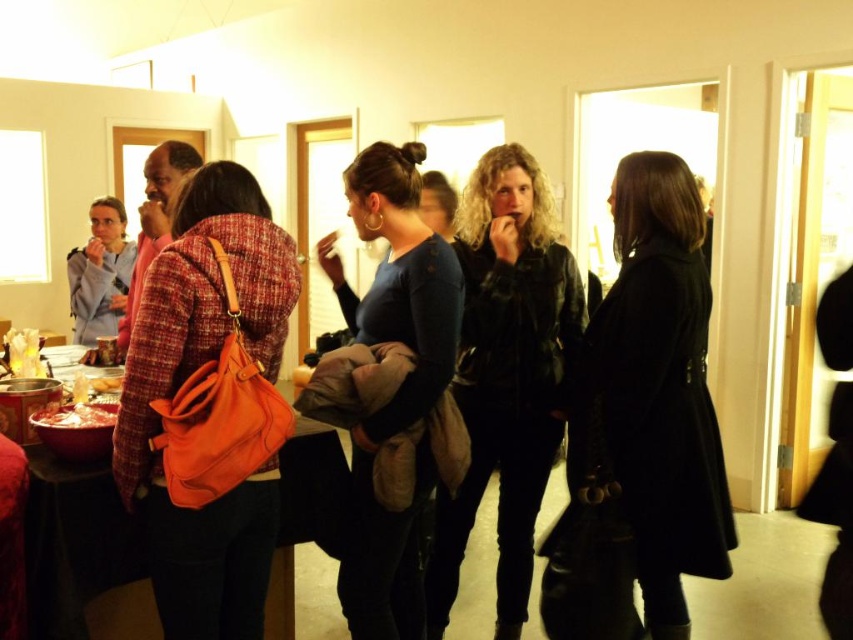
You are organizing a small event and need to place a decorative item on the table. The leather jacket at center is currently taking up space. Can the shiny metallic bowl at lower left be placed under the jacket without it being visible?

The leather jacket at center is taller than the shiny metallic bowl at lower left, so placing the bowl under the jacket would make it less visible since the jacket is taller and could obscure the bowl.